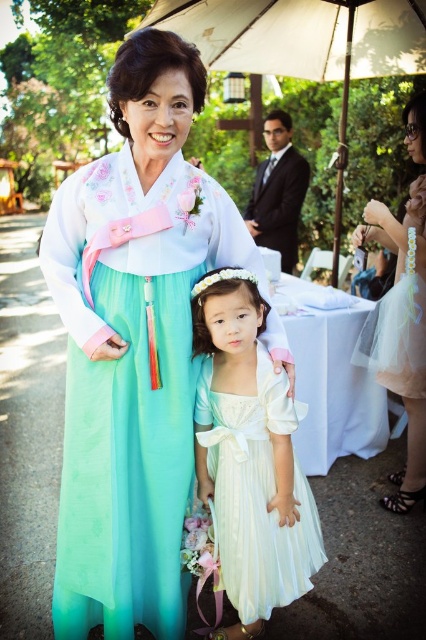
You are a photographer at the event and want to take a photo focusing on the white satin dress at center and dark blue satin suit at center. Which one is positioned in front of the other?

The white satin dress at center is closer to the viewer than the dark blue satin suit at center, so it is positioned in front of the dark blue satin suit at center.

You are standing at the position of point (414,477) and want to walk towards point (192,317). Will you be moving forward or backward relative to your current position?

Since point (192,317) is in front of point (414,477), moving towards it would mean moving forward relative to your current position.

You are a photographer at a formal event and need to position two guests wearing the white satin dress at center and the light pink tulle dress at right. Since you want to ensure both dresses are fully visible in the photo, which guest should you place closer to the camera to avoid any part of their dress being cut off?

You should place the guest wearing the white satin dress at center closer to the camera because its width is larger than the light pink tulle dress at right, ensuring the entire dress fits within the frame.